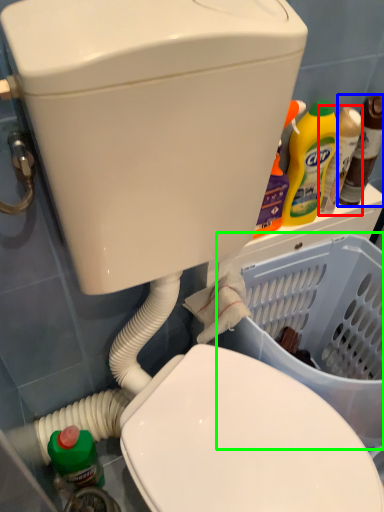
Question: Considering the real-world distances, which object is farthest from bottle (highlighted by a red box)? bottle (highlighted by a blue box) or basket container (highlighted by a green box)?

Choices:
 (A) bottle
 (B) basket container

Answer: (B)